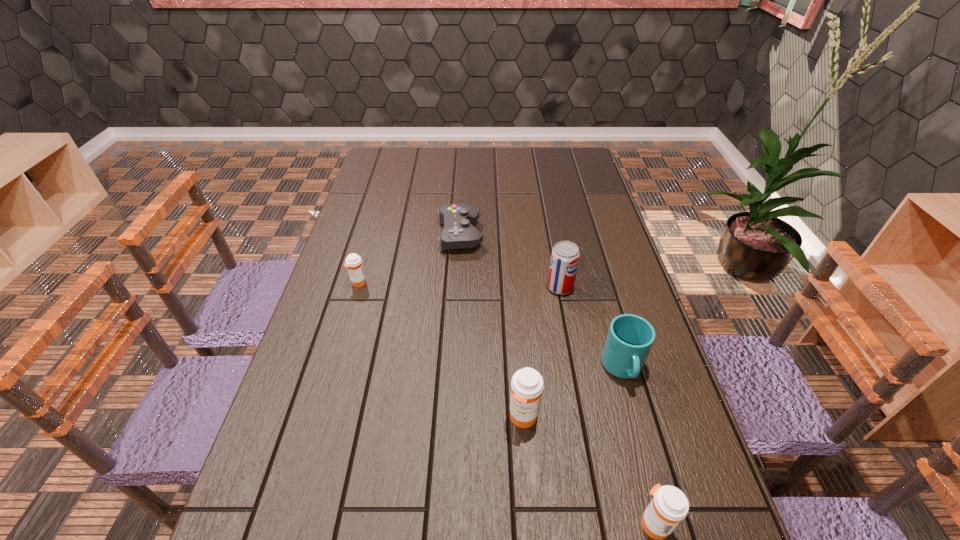
Locate an element on the screen. vacant space located 0.090m on the front of the soda is located at coordinates (566, 320).

Locate an element on the screen. The width and height of the screenshot is (960, 540). free space located 0.320m on the back of the second object from left to right is located at coordinates (464, 171).

The height and width of the screenshot is (540, 960). I want to click on free space located on the handle side of the cup, so click(659, 494).

At what (x,y) coordinates should I click in order to perform the action: click on object at the left edge. Please return your answer as a coordinate pair (x, y). Looking at the image, I should click on [353, 261].

Locate an element on the screen. object located at the right edge is located at coordinates (630, 337).

Locate an element on the screen. The width and height of the screenshot is (960, 540). free space at the far edge of the desktop is located at coordinates (542, 174).

In the image, there is a desktop. At what (x,y) coordinates should I click in order to perform the action: click on free region at the near edge. Please return your answer as a coordinate pair (x, y). Looking at the image, I should click on (409, 500).

In the image, there is a desktop. At what (x,y) coordinates should I click in order to perform the action: click on vacant space at the left edge. Please return your answer as a coordinate pair (x, y). The height and width of the screenshot is (540, 960). Looking at the image, I should click on (379, 220).

The width and height of the screenshot is (960, 540). I want to click on vacant space at the right edge of the desktop, so click(x=590, y=246).

This screenshot has width=960, height=540. Identify the location of free space between the farthest object and the fourth farthest object. (541, 302).